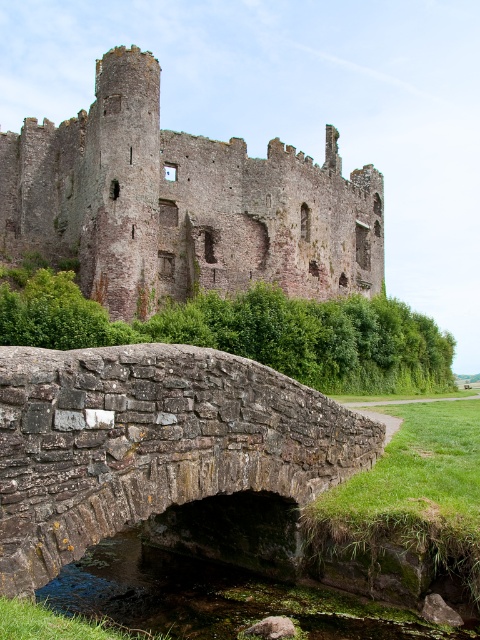
Question: Is the position of rustic stone castle at upper center more distant than that of rusty stone bridge at center?

Choices:
 (A) no
 (B) yes

Answer: (B)

Question: Observing the image, what is the correct spatial positioning of rustic stone castle at upper center in reference to rusty stone bridge at center?

Choices:
 (A) right
 (B) left

Answer: (B)

Question: Which object is closer to the camera taking this photo?

Choices:
 (A) rusty stone bridge at center
 (B) rustic stone castle at upper center

Answer: (A)

Question: Does rustic stone castle at upper center come in front of rusty stone bridge at center?

Choices:
 (A) no
 (B) yes

Answer: (A)

Question: Which object appears farthest from the camera in this image?

Choices:
 (A) rusty stone bridge at center
 (B) rustic stone castle at upper center

Answer: (B)